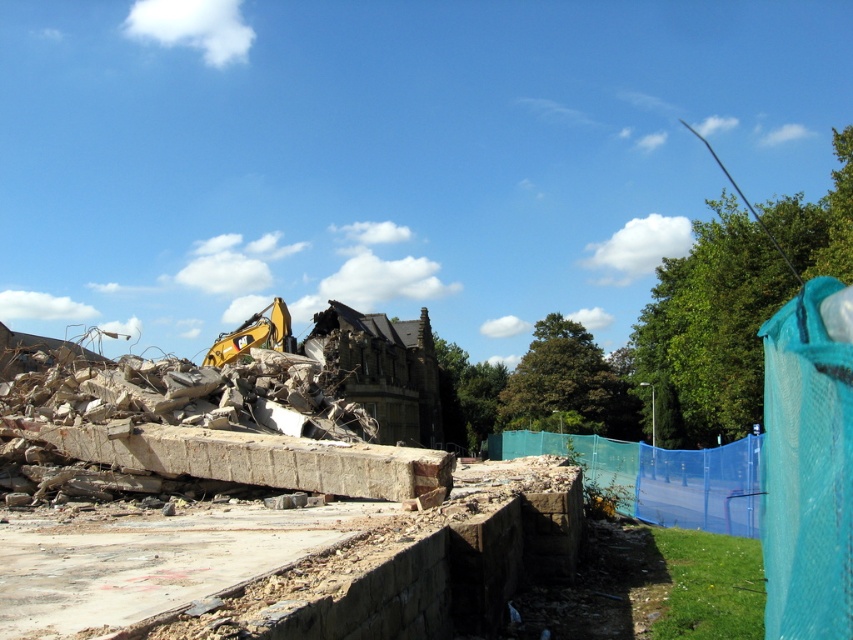
Does blue mesh fence at right have a smaller size compared to yellow metallic excavator at upper left?

Incorrect, blue mesh fence at right is not smaller in size than yellow metallic excavator at upper left.

Image resolution: width=853 pixels, height=640 pixels. I want to click on blue mesh fence at right, so click(659, 476).

Where is `blue mesh fence at right`? blue mesh fence at right is located at coordinates click(659, 476).